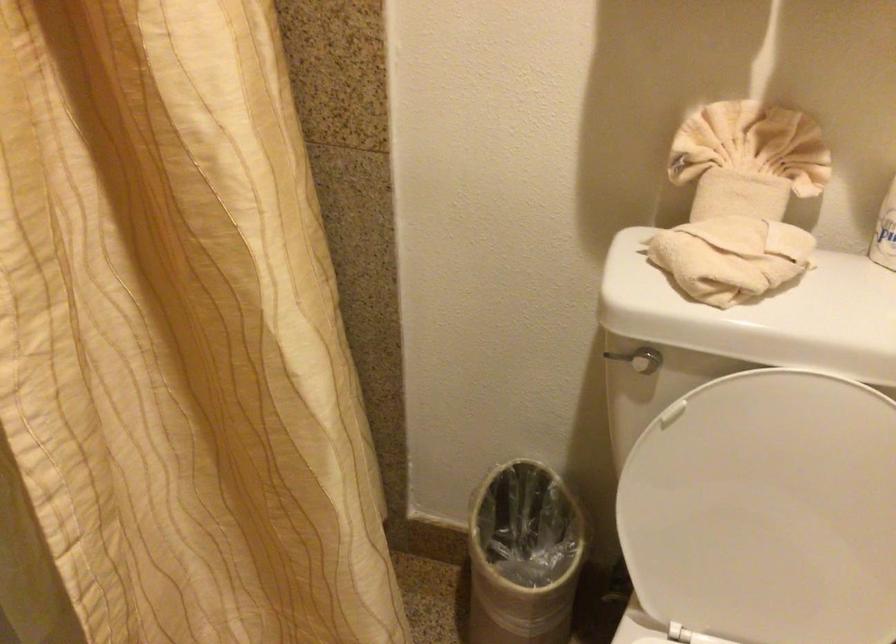
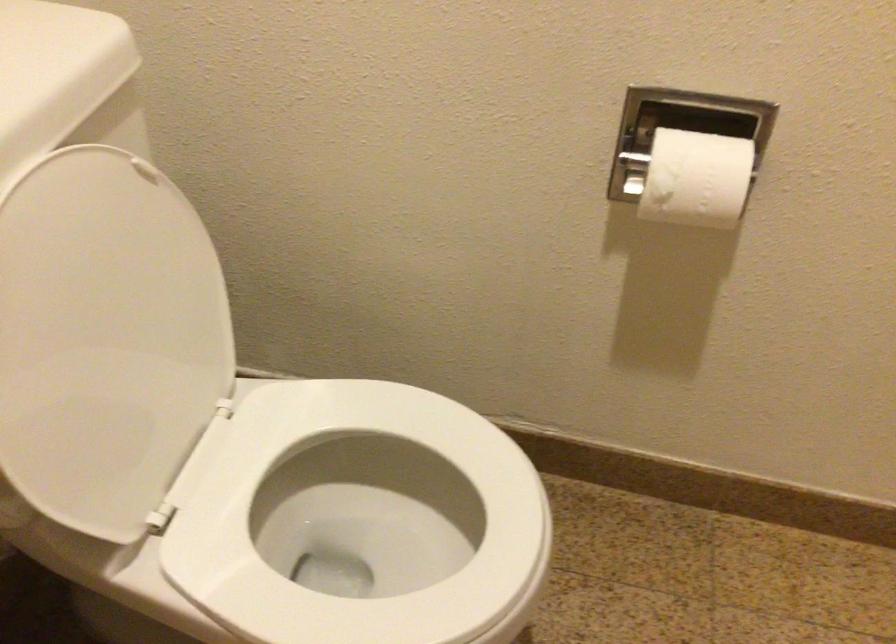
In the second image, find the point that corresponds to pixel 763 504 in the first image.

(105, 339)